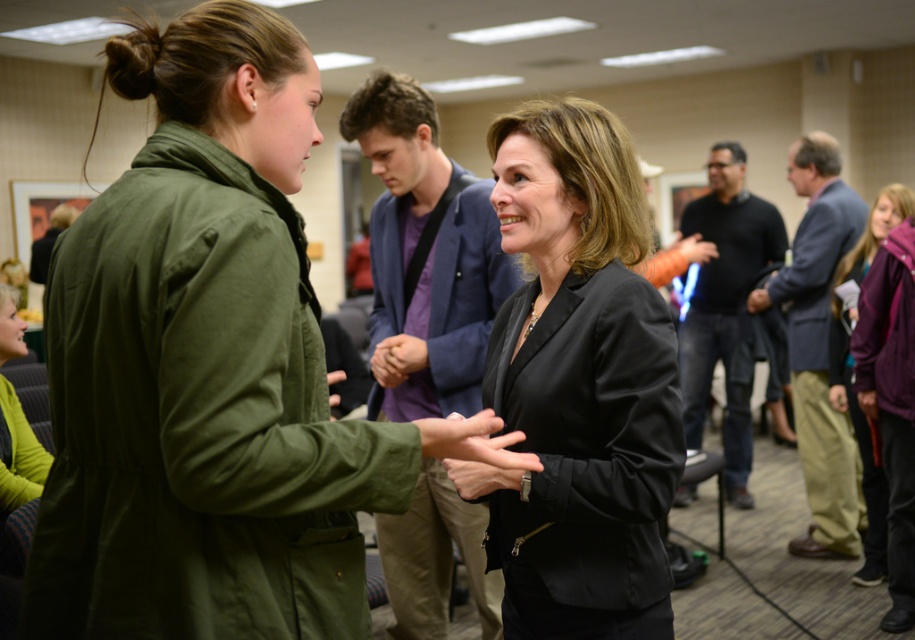
Question: Can you confirm if satin black blazer at center is positioned above gray wool suit at right?

Choices:
 (A) yes
 (B) no

Answer: (A)

Question: Is the position of satin black blazer at center more distant than that of gray wool suit at right?

Choices:
 (A) yes
 (B) no

Answer: (B)

Question: Is satin black blazer at center to the right of purple fleece jacket at lower right from the viewer's perspective?

Choices:
 (A) no
 (B) yes

Answer: (A)

Question: Which object is farther from the camera taking this photo?

Choices:
 (A) purple fleece jacket at lower right
 (B) dark blue sweater at center

Answer: (B)

Question: Which object appears farthest from the camera in this image?

Choices:
 (A) satin black blazer at center
 (B) gray wool suit at right
 (C) matte green jacket at center

Answer: (B)

Question: Which object is farther from the camera taking this photo?

Choices:
 (A) gray wool suit at right
 (B) matte green jacket at center

Answer: (A)